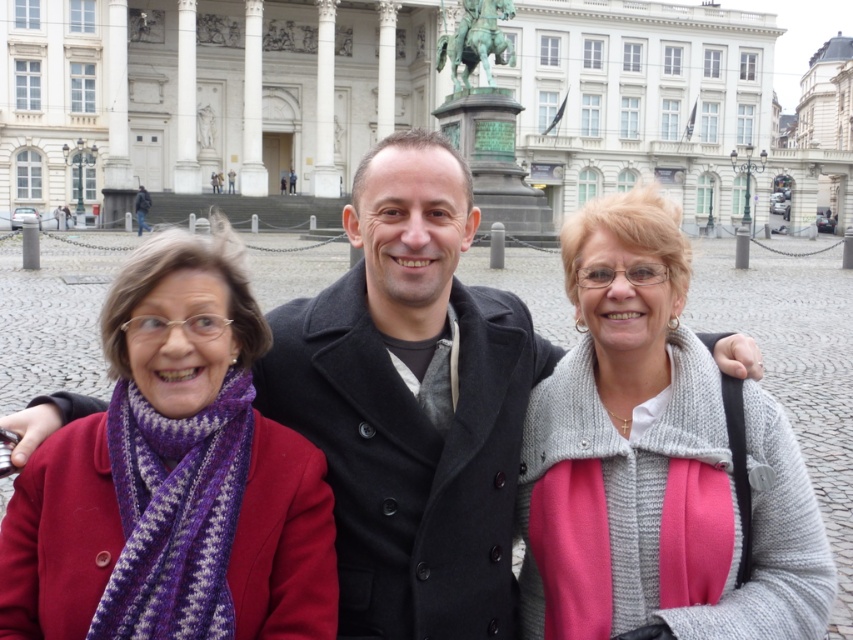
You are a photographer trying to capture a group photo of the two women and the man in front of the classical building. Since the knitted gray sweater at center and dark gray coat at center are both visible, which clothing item would you adjust to ensure the photo looks balanced, considering their sizes?

The knitted gray sweater at center is wider than the dark gray coat at center. To balance the photo, you should adjust the position of the knitted gray sweater at center to avoid overwhelming the composition.

You are an artist sketching the scene in front of you. You want to draw the purple knitted scarf at center first. Where should you look on the canvas to locate it?

The purple knitted scarf at center is located at point (x=173, y=477) on the canvas.

You are a photographer standing at the scene. You want to take a close up photo of the purple knitted scarf at center. Considering the distance from the camera to the scarf is 97.86 feet, is it feasible to capture a clear close up without any zoom?

The purple knitted scarf at center is 97.86 feet away from the camera. Without zoom, capturing a clear close up at this distance would be challenging as the scarf would appear too small in the frame. A zoom lens is recommended to achieve clarity.